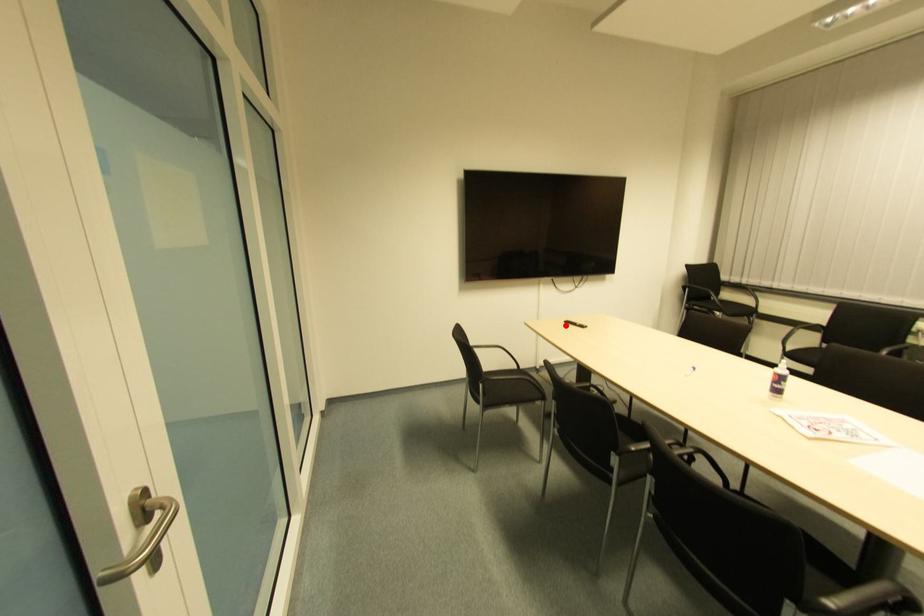
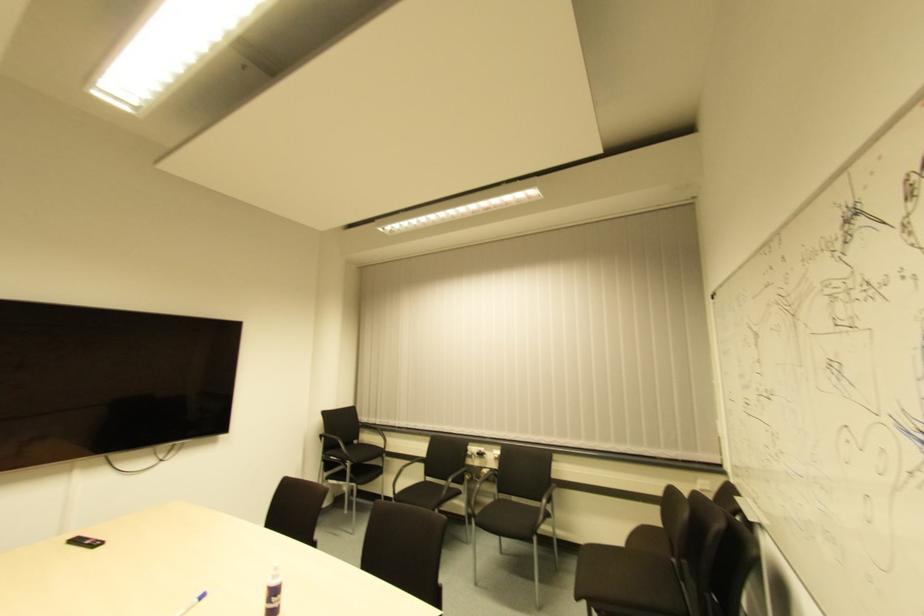
Question: I am providing you with two images of the same scene from different viewpoints. In image1, a red point is highlighted. Considering the same 3D point in image2, which of the following is correct?

Choices:
 (A) It is closer
 (B) It is farther

Answer: (A)